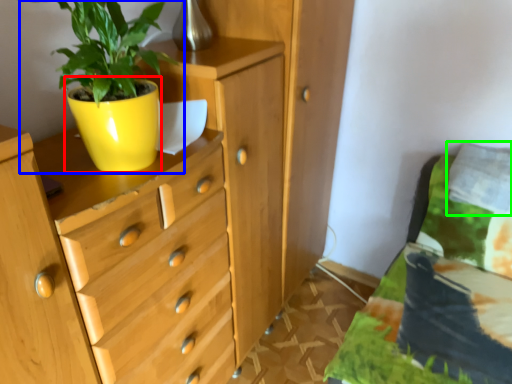
Question: Which is nearer to the flowerpot (highlighted by a red box)? houseplant (highlighted by a blue box) or pillow (highlighted by a green box).

Choices:
 (A) houseplant
 (B) pillow

Answer: (A)